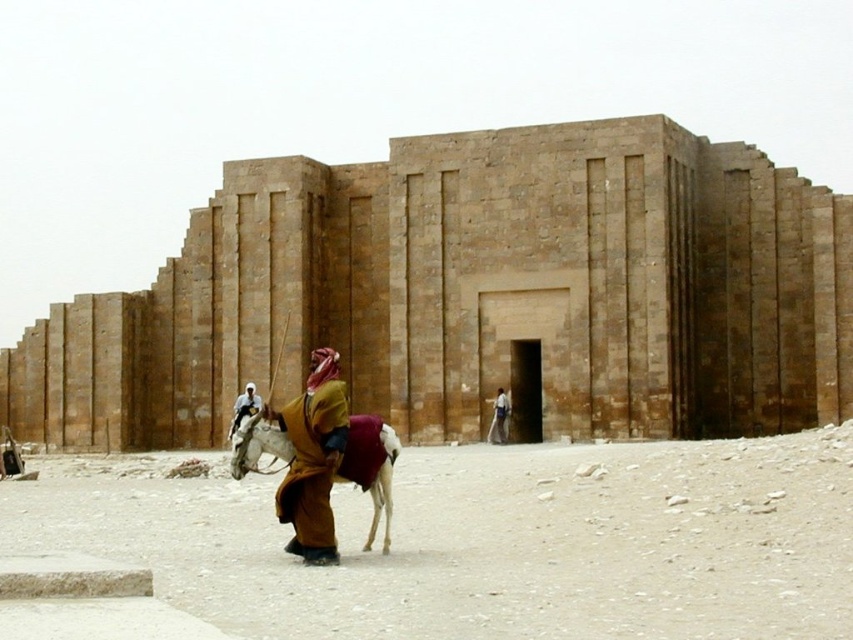
This screenshot has height=640, width=853. Describe the element at coordinates (370, 468) in the screenshot. I see `brown leather mule at center` at that location.

At what (x,y) coordinates should I click in order to perform the action: click on brown leather mule at center. Please return your answer as a coordinate pair (x, y). The height and width of the screenshot is (640, 853). Looking at the image, I should click on (370, 468).

The height and width of the screenshot is (640, 853). I want to click on brown leather mule at center, so click(370, 468).

Does brown woolen robe at center have a greater width compared to brown leather mule at center?

No, brown woolen robe at center is not wider than brown leather mule at center.

Looking at this image, is brown woolen robe at center to the right of brown leather mule at center from the viewer's perspective?

Indeed, brown woolen robe at center is positioned on the right side of brown leather mule at center.

Is point (297, 481) positioned behind point (259, 412)?

No, it is in front of (259, 412).

Identify the location of brown woolen robe at center. Image resolution: width=853 pixels, height=640 pixels. (312, 458).

Based on the photo, does brown woolen robe at center have a greater height compared to light brown leather jacket at center?

Indeed, brown woolen robe at center has a greater height compared to light brown leather jacket at center.

Can you confirm if brown woolen robe at center is positioned below light brown leather jacket at center?

No, brown woolen robe at center is not below light brown leather jacket at center.

The height and width of the screenshot is (640, 853). What do you see at coordinates (312, 458) in the screenshot?
I see `brown woolen robe at center` at bounding box center [312, 458].

The width and height of the screenshot is (853, 640). In order to click on brown woolen robe at center in this screenshot , I will do `click(312, 458)`.